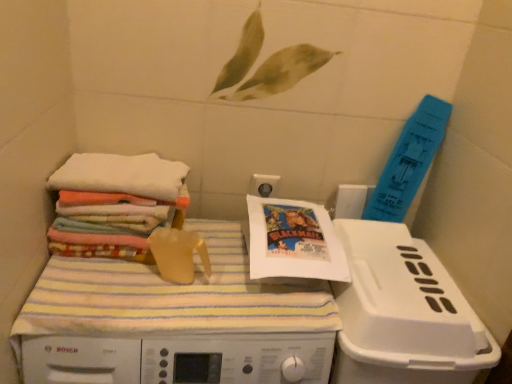
Image resolution: width=512 pixels, height=384 pixels. Identify the location of free space above white plastic machine at center (from a real-world perspective). (188, 286).